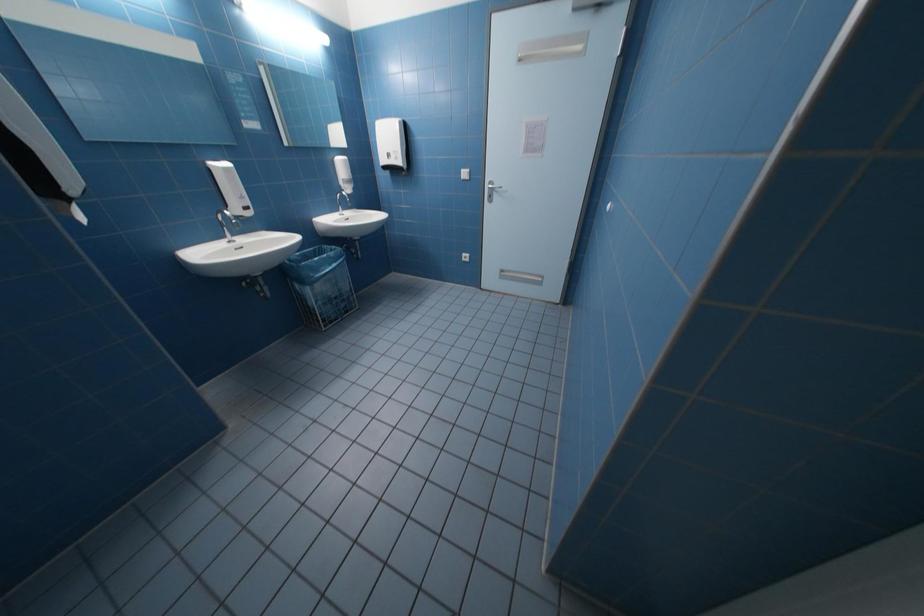
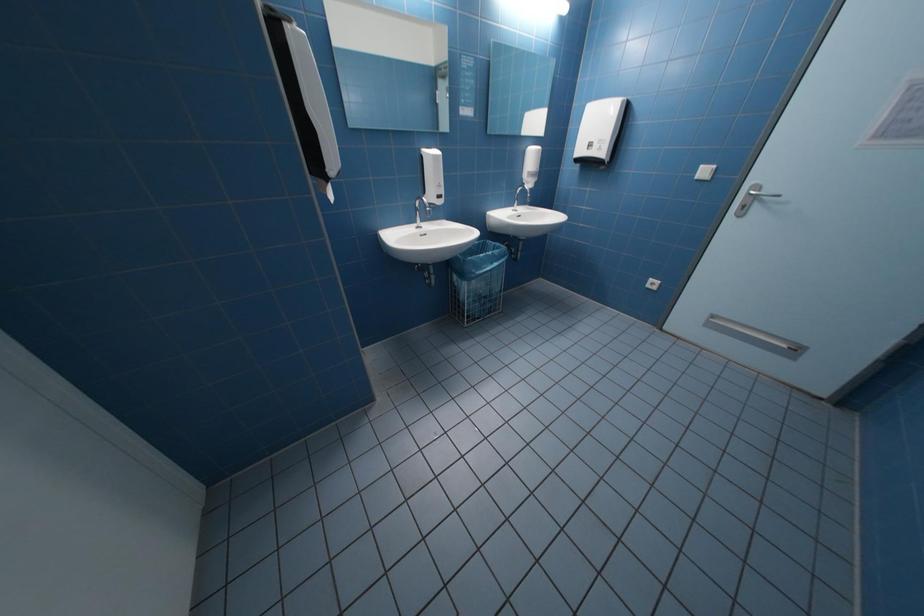
What movement of the cameraman would produce the second image?

The cameraman walked toward left, forward.